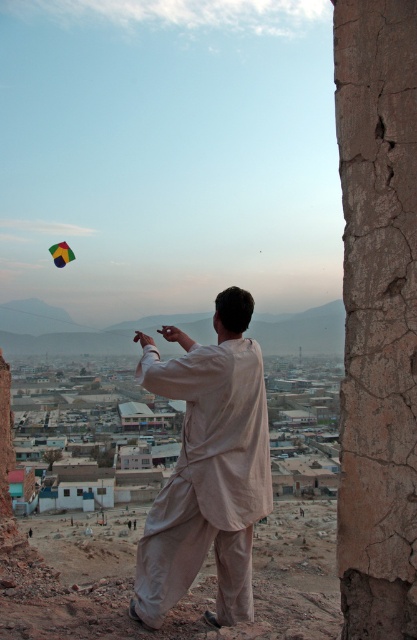
Does light beige cotton kurta at center appear on the left side of multicolored fabric kite at upper left?

In fact, light beige cotton kurta at center is to the right of multicolored fabric kite at upper left.

How much distance is there between light beige cotton kurta at center and multicolored fabric kite at upper left?

351.54 meters

Is point (211, 378) positioned after point (65, 262)?

No.

Where is `light beige cotton kurta at center`? This screenshot has width=417, height=640. light beige cotton kurta at center is located at coordinates (208, 467).